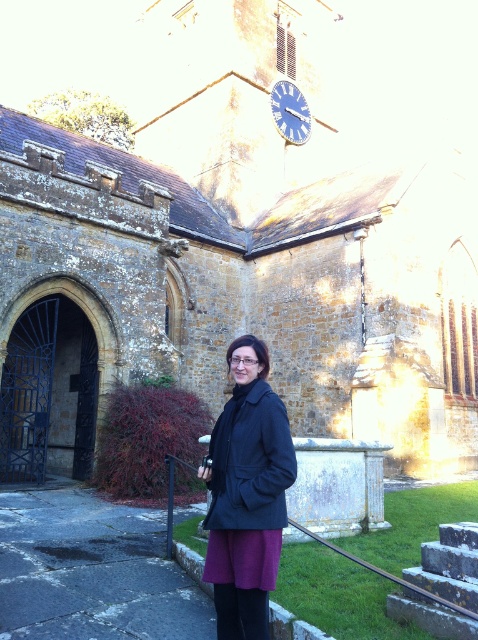
Which is behind, point (214, 561) or point (278, 115)?

The point (278, 115) is behind.

Which of these two, dark blue coat at center or blue metallic clock at upper center, stands taller?

dark blue coat at center is taller.

Does point (263, 550) come farther from viewer compared to point (276, 86)?

No, (263, 550) is closer to viewer.

You are a GUI agent. You are given a task and a screenshot of the screen. Output one action in this format:
    pyautogui.click(x=<x>, y=<y>)
    Task: Click on the dark blue coat at center
    
    Given the screenshot: What is the action you would take?
    pyautogui.click(x=247, y=493)